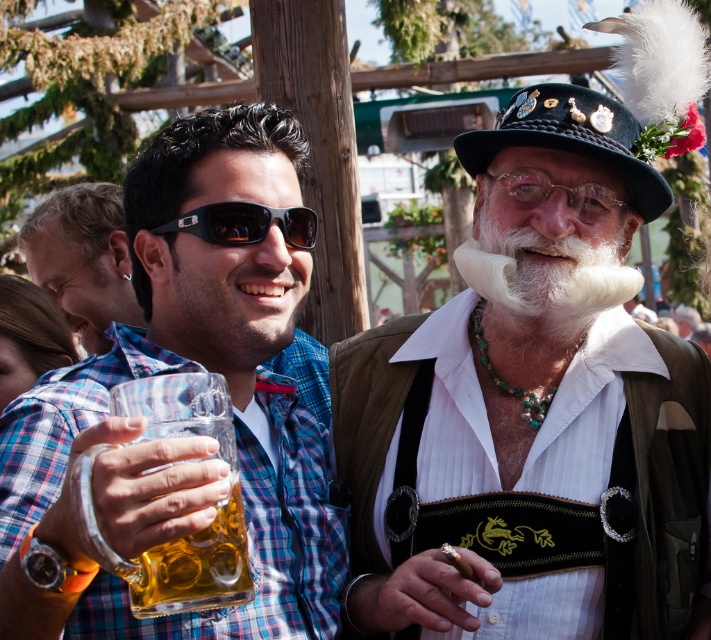
Question: Which point is closer to the camera?

Choices:
 (A) (606, 294)
 (B) (255, 316)

Answer: (B)

Question: Does clear glass mug at left appear under black matte sunglasses at center?

Choices:
 (A) no
 (B) yes

Answer: (B)

Question: Does matte black shirt at upper left appear over black felt hat at upper right?

Choices:
 (A) yes
 (B) no

Answer: (B)

Question: Is brown fuzzy beard at center bigger than black felt hat at upper right?

Choices:
 (A) yes
 (B) no

Answer: (B)

Question: Among these points, which one is farthest from the camera?

Choices:
 (A) (604, 429)
 (B) (203, 212)
 (C) (252, 257)

Answer: (A)

Question: Which of the following is the closest to the observer?

Choices:
 (A) (176, 348)
 (B) (63, 467)

Answer: (B)